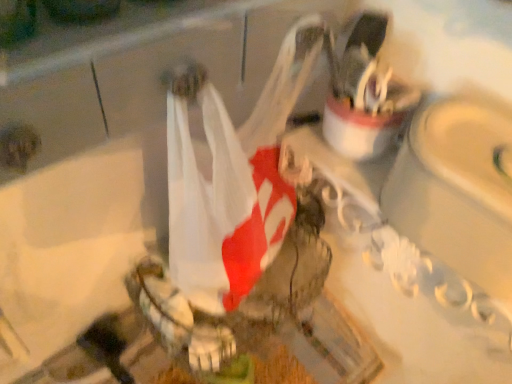
What is the approximate width of white plastic bag at center?

white plastic bag at center is 8.96 inches wide.

In order to face white plastic bag at center, should I rotate leftwards or rightwards?

You should rotate left by 7.689 degrees.

Locate an element on the screen. The width and height of the screenshot is (512, 384). white plastic bag at center is located at coordinates (233, 179).

The image size is (512, 384). Describe the element at coordinates (233, 179) in the screenshot. I see `white plastic bag at center` at that location.

This screenshot has height=384, width=512. I want to click on white plastic bag at center, so click(233, 179).